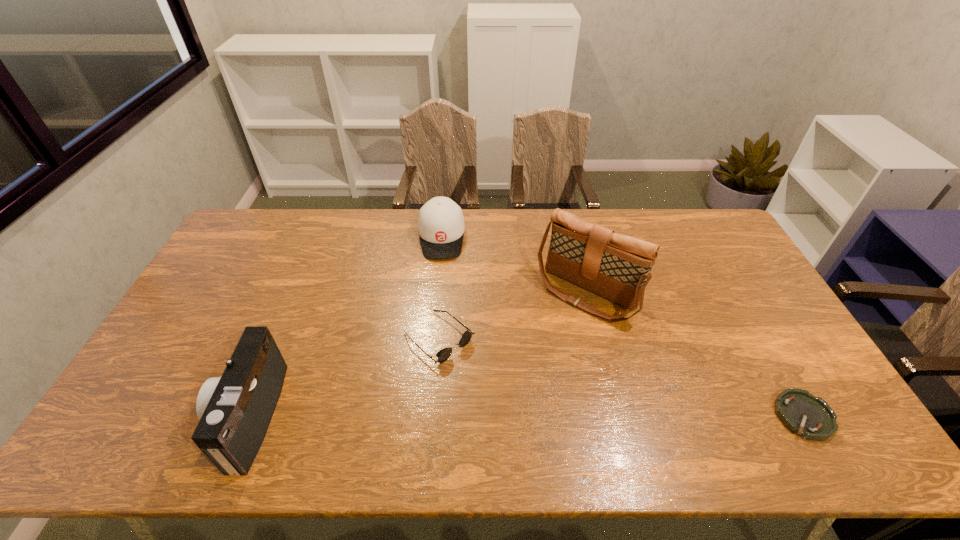
The width and height of the screenshot is (960, 540). Find the location of `free spot between the camcorder and the tallest object`. free spot between the camcorder and the tallest object is located at coordinates (418, 354).

Where is `free space between the shoulder bag and the rightmost object`? The image size is (960, 540). free space between the shoulder bag and the rightmost object is located at coordinates (695, 354).

Where is `empty space that is in between the rightmost object and the second shortest object`? The width and height of the screenshot is (960, 540). empty space that is in between the rightmost object and the second shortest object is located at coordinates [621, 377].

Identify which object is the second nearest to the sunglasses. Please provide its 2D coordinates. Your answer should be formatted as a tuple, i.e. [(x, y)], where the tuple contains the x and y coordinates of a point satisfying the conditions above.

[(441, 226)]

I want to click on object that can be found as the second closest to the sunglasses, so click(441, 226).

The image size is (960, 540). What are the coordinates of `free space that satisfies the following two spatial constraints: 1. on the front side of the tallest object; 2. on the right side of the rightmost object` in the screenshot? It's located at (616, 416).